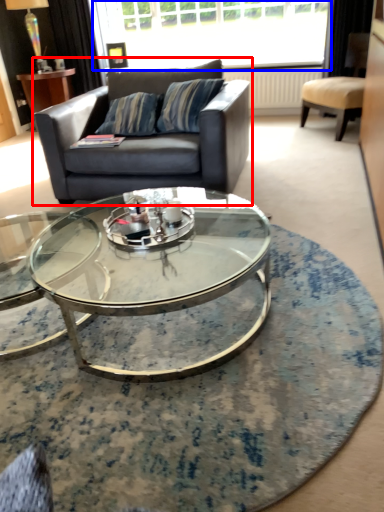
Question: Which point is further to the camera, studio couch (highlighted by a red box) or window (highlighted by a blue box)?

Choices:
 (A) studio couch
 (B) window

Answer: (B)